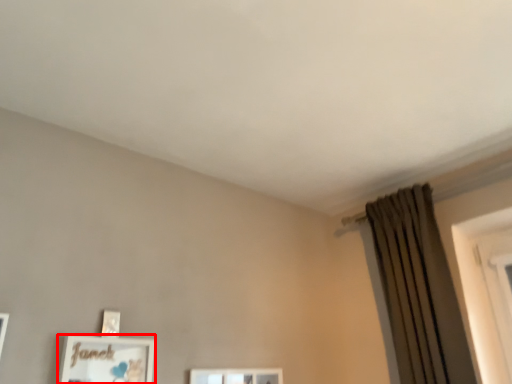
Question: Considering the relative positions of picture frame (annotated by the red box) and curtain in the image provided, where is picture frame (annotated by the red box) located with respect to the staircase?

Choices:
 (A) left
 (B) right

Answer: (A)